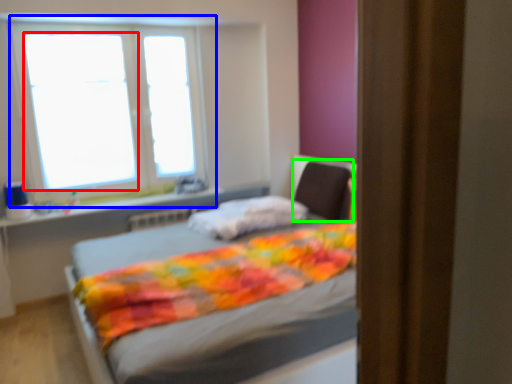
Question: Which is farther away from window screen (highlighted by a red box)? window (highlighted by a blue box) or swivel chair (highlighted by a green box)?

Choices:
 (A) window
 (B) swivel chair

Answer: (B)